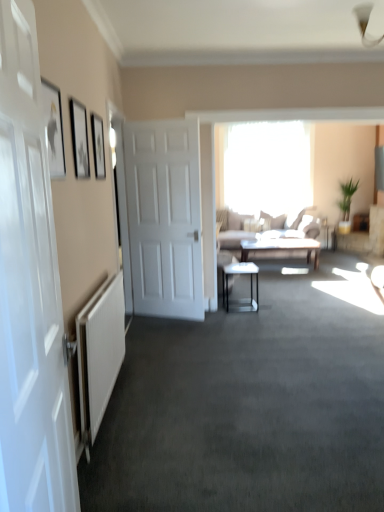
You are a GUI agent. You are given a task and a screenshot of the screen. Output one action in this format:
    pyautogui.click(x=<x>, y=<y>)
    Task: Click on the empty space that is ontop of white matte door at center, which appears as the first door when viewed from the back (from a real-world perspective)
    The image size is (384, 512).
    Given the screenshot: What is the action you would take?
    pyautogui.click(x=159, y=120)